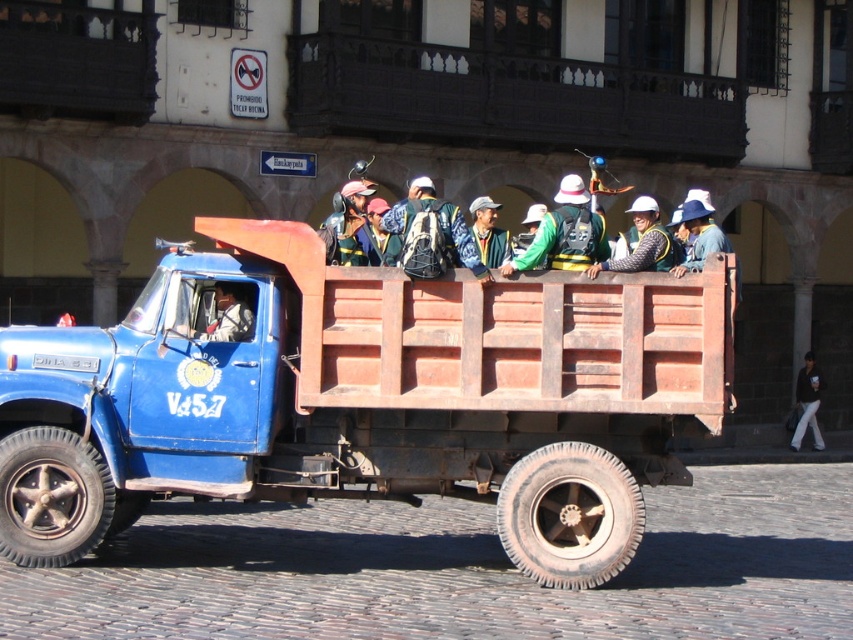
Question: Estimate the real-world distances between objects in this image. Which object is closer to the blue matte truck at center?

Choices:
 (A) green fabric jacket at center
 (B) blue fabric backpack at center

Answer: (A)

Question: Which object is closer to the camera taking this photo?

Choices:
 (A) blue fabric backpack at center
 (B) blue matte truck at center
 (C) green fabric jacket at center

Answer: (B)

Question: Which is farther from the blue matte truck at center?

Choices:
 (A) blue fabric backpack at center
 (B) green fabric jacket at center

Answer: (A)

Question: Does green fabric jacket at center appear on the left side of blue fabric backpack at center?

Choices:
 (A) yes
 (B) no

Answer: (B)

Question: Is blue matte truck at center below blue fabric backpack at center?

Choices:
 (A) no
 (B) yes

Answer: (B)

Question: Is blue matte truck at center further to camera compared to blue fabric backpack at center?

Choices:
 (A) yes
 (B) no

Answer: (B)